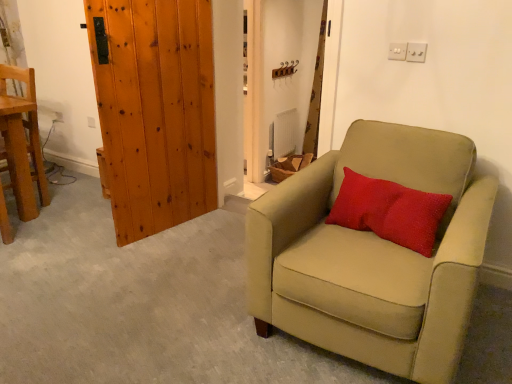
At what (x,y) coordinates should I click in order to perform the action: click on vacant area that is situated to the right of wooden plank door at left. Please return your answer as a coordinate pair (x, y). Image resolution: width=512 pixels, height=384 pixels. Looking at the image, I should click on (210, 229).